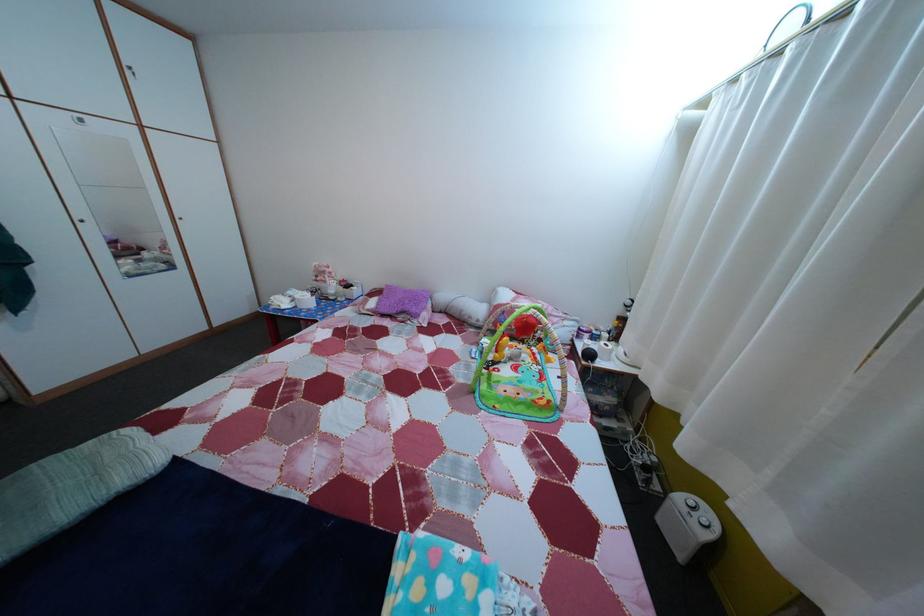
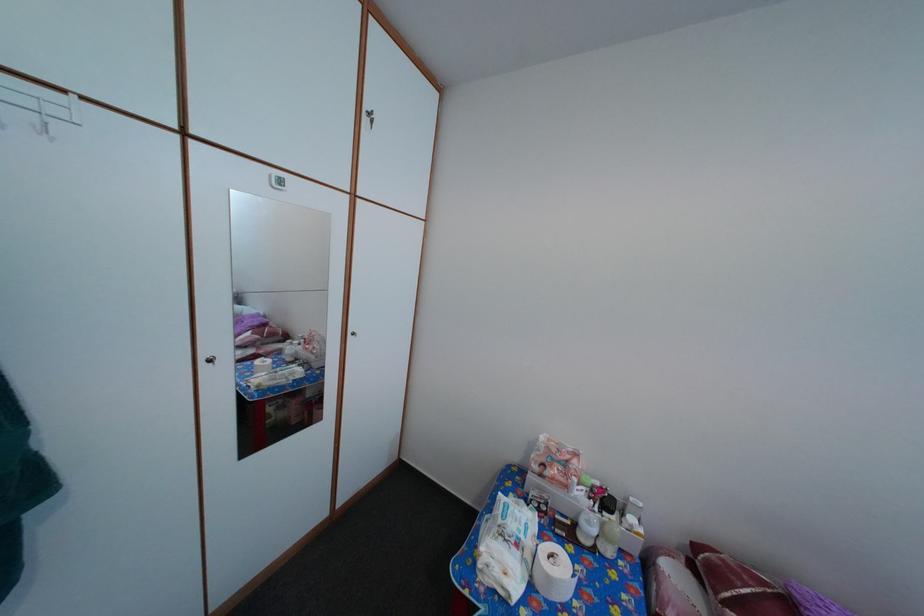
The point at (x=334, y=280) is marked in the first image. Where is the corresponding point in the second image?

(576, 469)